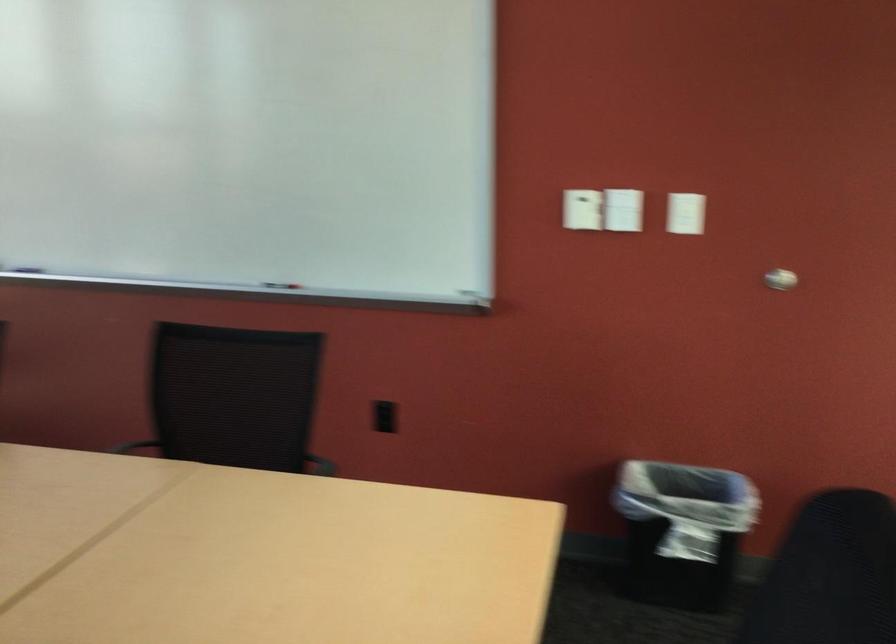
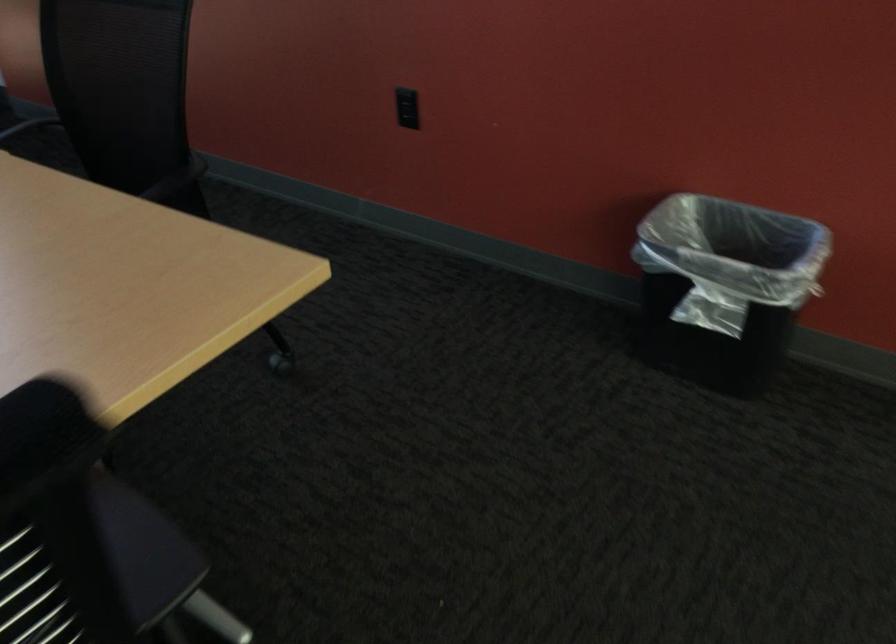
Based on the continuous images, in which direction is the camera rotating?

The camera's rotation is toward left-down.